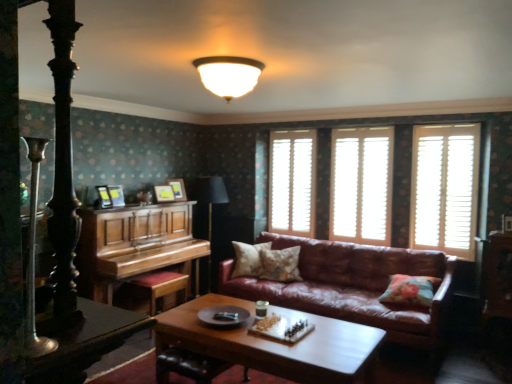
Question: From the image's perspective, does leather at center appear higher than wooden picture frame at upper center, which ranks as the 2th picture frame in right-to-left order?

Choices:
 (A) no
 (B) yes

Answer: (A)

Question: From a real-world perspective, is leather at center under wooden picture frame at upper center, arranged as the second picture frame when viewed from the left?

Choices:
 (A) no
 (B) yes

Answer: (B)

Question: Does leather at center come behind wooden picture frame at upper center, which is the second picture frame in front-to-back order?

Choices:
 (A) no
 (B) yes

Answer: (A)

Question: Is leather at center thinner than wooden picture frame at upper center, which is the second picture frame from back to front?

Choices:
 (A) yes
 (B) no

Answer: (B)

Question: Could you tell me if leather at center is turned towards wooden picture frame at upper center, which ranks as the 2th picture frame in right-to-left order?

Choices:
 (A) yes
 (B) no

Answer: (B)

Question: From the image's perspective, is wooden picture frame at upper center, the first picture frame when ordered from right to left, located above or below wooden chessboard at center?

Choices:
 (A) below
 (B) above

Answer: (B)

Question: From a real-world perspective, is wooden picture frame at upper center, the first picture frame when ordered from right to left, above or below wooden chessboard at center?

Choices:
 (A) below
 (B) above

Answer: (B)

Question: Is wooden picture frame at upper center, the 3th picture frame from the left, bigger or smaller than wooden chessboard at center?

Choices:
 (A) small
 (B) big

Answer: (A)

Question: Considering the positions of point (172, 183) and point (340, 362), is point (172, 183) closer or farther from the camera than point (340, 362)?

Choices:
 (A) closer
 (B) farther

Answer: (B)

Question: Based on their positions, is white wooden shutters at center, which is the 1th window in back-to-front order, located to the left or right of wooden picture frame at center, which appears as the 1th picture frame when viewed from the front?

Choices:
 (A) left
 (B) right

Answer: (B)

Question: Is white wooden shutters at center, the third window from the front, wider or thinner than wooden picture frame at center, acting as the 3th picture frame starting from the back?

Choices:
 (A) thin
 (B) wide

Answer: (A)

Question: Considering their positions, is white wooden shutters at center, which is the 1th window in back-to-front order, located in front of or behind wooden picture frame at center, marked as the 1th picture frame in a left-to-right arrangement?

Choices:
 (A) front
 (B) behind

Answer: (B)

Question: Does point (286, 147) appear closer or farther from the camera than point (103, 206)?

Choices:
 (A) closer
 (B) farther

Answer: (B)

Question: Is point (174, 198) closer or farther from the camera than point (91, 340)?

Choices:
 (A) closer
 (B) farther

Answer: (B)

Question: In the image, is wooden picture frame at upper center, which is the second picture frame from back to front, on the left side or the right side of shiny black table at lower left?

Choices:
 (A) right
 (B) left

Answer: (B)